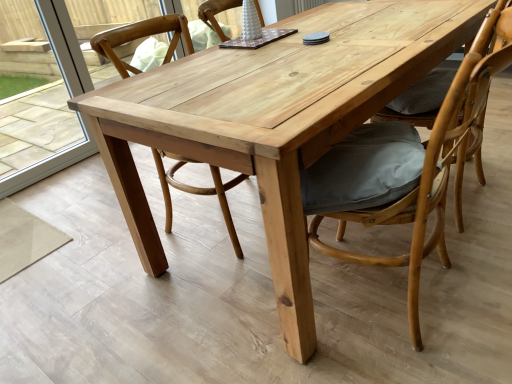
Locate an element on the screen. The height and width of the screenshot is (384, 512). vacant space situated on the left part of natural wood chair at center, the 3th chair from the right is located at coordinates click(x=106, y=243).